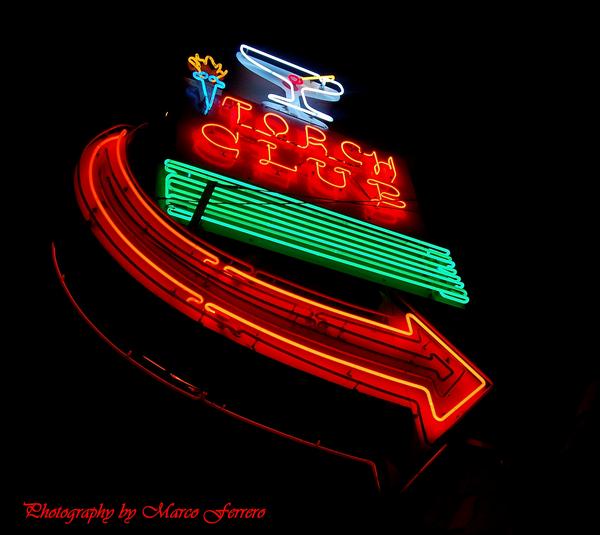
Where is `neon sign`? This screenshot has height=535, width=600. neon sign is located at coordinates (316, 227).